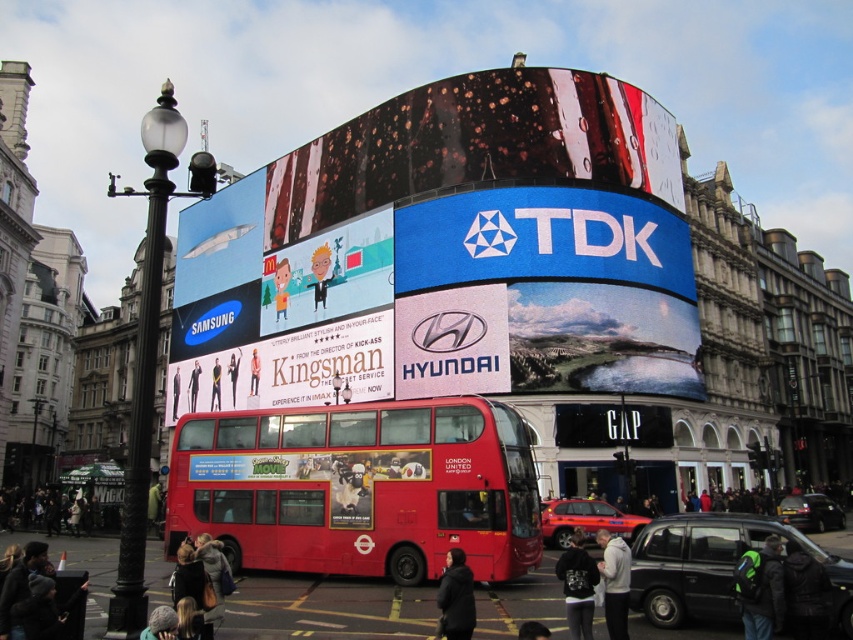
Question: Can you confirm if red matte double-decker bus at center is positioned below dark gray hoodie at center?

Choices:
 (A) yes
 (B) no

Answer: (B)

Question: Is matte red bus at center below dark gray hoodie at center?

Choices:
 (A) no
 (B) yes

Answer: (A)

Question: Is dark gray jacket at lower left positioned behind dark brown hair at center?

Choices:
 (A) yes
 (B) no

Answer: (A)

Question: Which point is farther from the camera taking this photo?

Choices:
 (A) pyautogui.click(x=582, y=627)
 (B) pyautogui.click(x=466, y=621)
 (C) pyautogui.click(x=289, y=173)

Answer: (C)

Question: Which object appears closest to the camera in this image?

Choices:
 (A) dark brown hair at center
 (B) red matte double-decker bus at center

Answer: (A)

Question: Which object is farther from the camera taking this photo?

Choices:
 (A) blue digital screen at center
 (B) green backpack at center
 (C) dark brown hair at center
 (D) dark gray hoodie at center

Answer: (A)